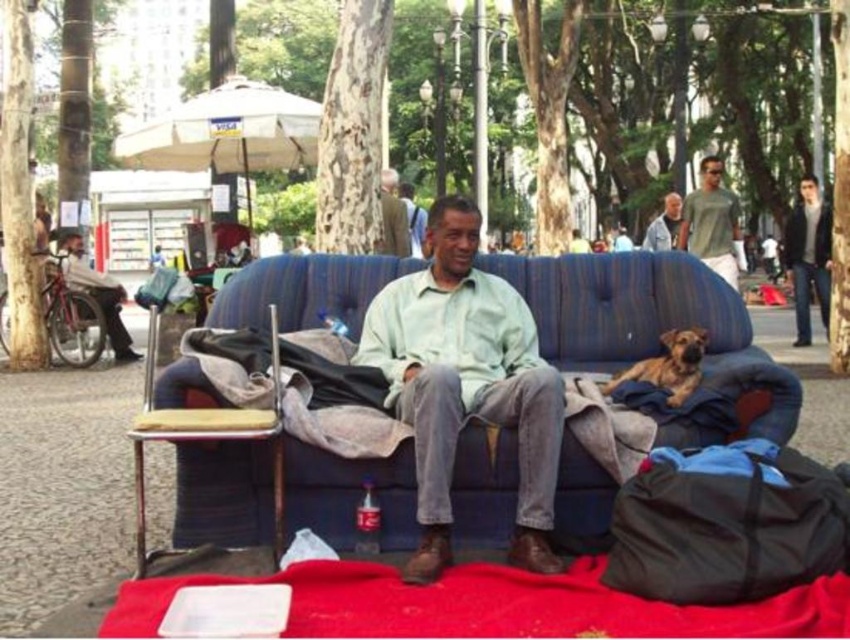
Can you confirm if light green cotton shirt at center is smaller than brown fur dog at right?

Incorrect, light green cotton shirt at center is not smaller in size than brown fur dog at right.

Is point (429, 477) closer to camera compared to point (673, 372)?

Yes, point (429, 477) is closer to viewer.

Is point (524, 429) positioned in front of point (690, 349)?

Yes, point (524, 429) is in front of point (690, 349).

This screenshot has width=850, height=640. Identify the location of light green cotton shirt at center. (465, 384).

Which is below, dark gray jacket at right or smooth gray shirt at upper center?

dark gray jacket at right

Measure the distance between point (820, 252) and camera.

A distance of 7.47 meters exists between point (820, 252) and camera.

Identify the location of dark gray jacket at right. The image size is (850, 640). (808, 256).

Does dark gray jacket at right appear under light brown leather jacket at upper center?

Actually, dark gray jacket at right is above light brown leather jacket at upper center.

Who is lower down, dark gray jacket at right or light brown leather jacket at upper center?

Positioned lower is light brown leather jacket at upper center.

Who is more distant from viewer, (x=797, y=218) or (x=408, y=243)?

The point (x=797, y=218) is behind.

You are a GUI agent. You are given a task and a screenshot of the screen. Output one action in this format:
    pyautogui.click(x=<x>, y=<y>)
    Task: Click on the dark gray jacket at right
    Image resolution: width=850 pixels, height=640 pixels.
    Given the screenshot: What is the action you would take?
    pyautogui.click(x=808, y=256)